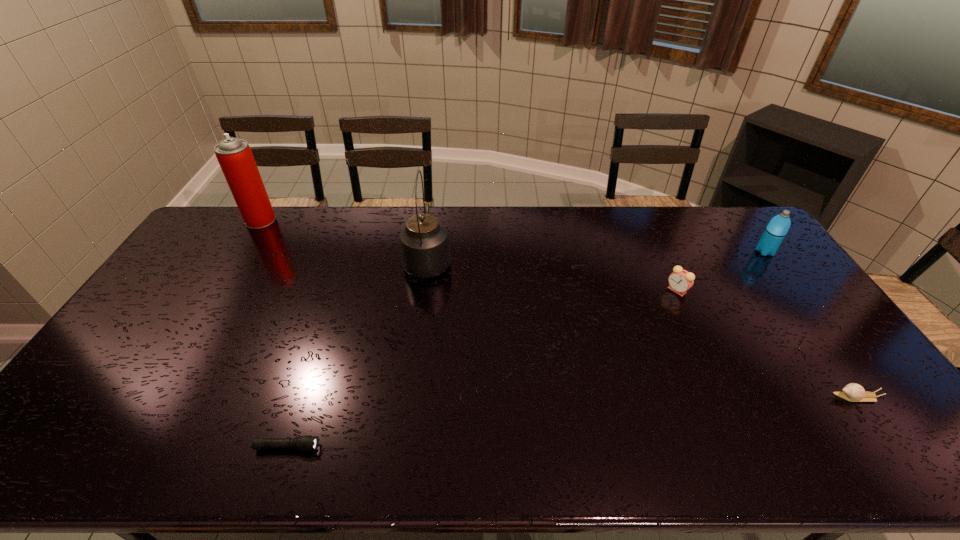
The height and width of the screenshot is (540, 960). Find the location of `the farthest object`. the farthest object is located at coordinates (234, 155).

Locate an element on the screen. The height and width of the screenshot is (540, 960). aerosol can is located at coordinates (234, 155).

I want to click on kettle, so click(425, 253).

The image size is (960, 540). What are the coordinates of `thermos bottle` in the screenshot? It's located at (779, 225).

Find the location of a particular element. The width and height of the screenshot is (960, 540). the fourth tallest object is located at coordinates (680, 281).

You are a GUI agent. You are given a task and a screenshot of the screen. Output one action in this format:
    pyautogui.click(x=<x>, y=<y>)
    Task: Click on the alarm clock
    
    Given the screenshot: What is the action you would take?
    [680, 281]

The height and width of the screenshot is (540, 960). Find the location of `escargot`. escargot is located at coordinates (853, 392).

Locate an element on the screen. the fifth tallest object is located at coordinates (853, 392).

The height and width of the screenshot is (540, 960). Identify the location of flashlight. (307, 443).

You are a GUI agent. You are given a task and a screenshot of the screen. Output one action in this format:
    pyautogui.click(x=<x>, y=<y>)
    Task: Click on the shortest object
    The height and width of the screenshot is (540, 960).
    Given the screenshot: What is the action you would take?
    pyautogui.click(x=307, y=443)